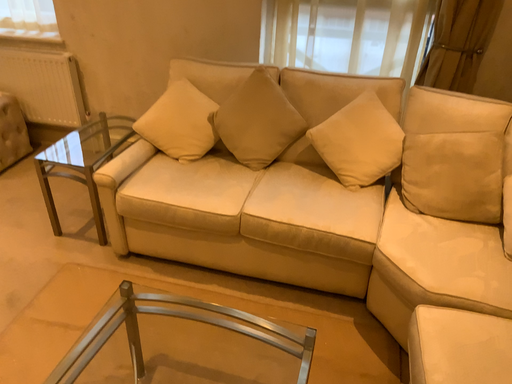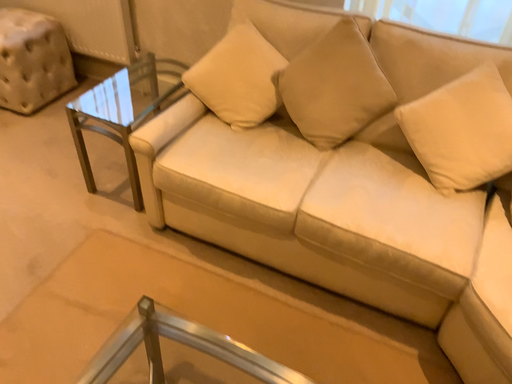
Question: How did the camera likely rotate when shooting the video?

Choices:
 (A) rotated upward
 (B) rotated downward

Answer: (B)